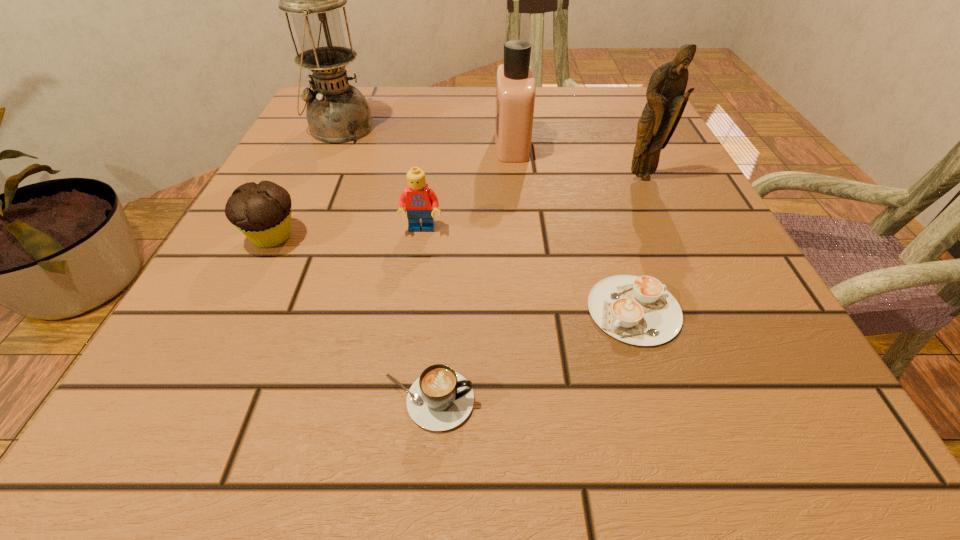
Locate an element on the screen. This screenshot has height=540, width=960. the right cappuccino is located at coordinates click(640, 311).

The height and width of the screenshot is (540, 960). Find the location of `vacant space situated on the front of the tallest object`. vacant space situated on the front of the tallest object is located at coordinates (325, 159).

Identify the location of free space located on the front-facing side of the fifth nearest object. The image size is (960, 540). (691, 286).

Where is `blank space located on the front label of the third tallest object`? blank space located on the front label of the third tallest object is located at coordinates (398, 145).

The height and width of the screenshot is (540, 960). What are the coordinates of `vacant space located on the front label of the third tallest object` in the screenshot? It's located at (403, 145).

You are a GUI agent. You are given a task and a screenshot of the screen. Output one action in this format:
    pyautogui.click(x=<x>, y=<y>)
    Task: Click on the vacant space located 0.320m on the front label of the third tallest object
    
    Given the screenshot: What is the action you would take?
    pyautogui.click(x=340, y=145)

Identify the location of vacant space located on the face of the Lego. (401, 371).

At what (x,y) coordinates should I click in order to perform the action: click on free space located on the right of the third shortest object. Please return your answer as a coordinate pair (x, y). Image resolution: width=960 pixels, height=540 pixels. Looking at the image, I should click on (413, 237).

I want to click on vacant space located 0.400m with the handle on the side of the sixth tallest object, so click(x=821, y=401).

The height and width of the screenshot is (540, 960). I want to click on vacant area situated on the right of the shorter cappuccino, so click(753, 310).